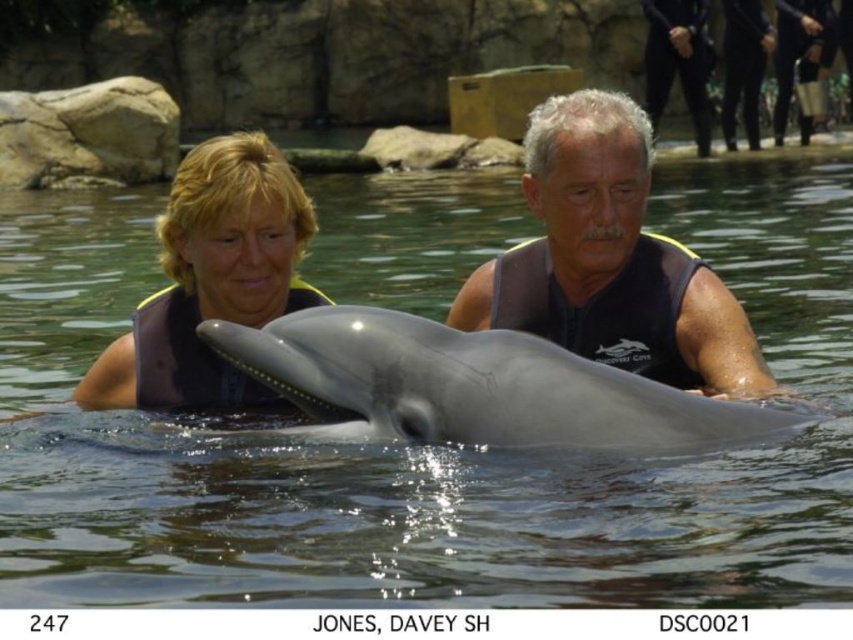
You are a photographer trying to capture a wide shot of the scene. The clear water at dolphin center and the black neoprene wetsuit at upper right are both in your frame. Which object occupies a larger portion of the image horizontally?

The clear water at dolphin center occupies a larger portion of the image horizontally because its width surpasses that of the black neoprene wetsuit at upper right.

You are a photographer trying to capture a wide shot of the scene. Given that the matte black wetsuit at upper left and the matte black wetsuit at upper center are both in your frame, which one would you focus on to ensure both are visible without cropping?

A: The matte black wetsuit at upper left occupies less space than the matte black wetsuit at upper center, so focusing on the larger matte black wetsuit at upper center would help keep both in the frame without cropping.